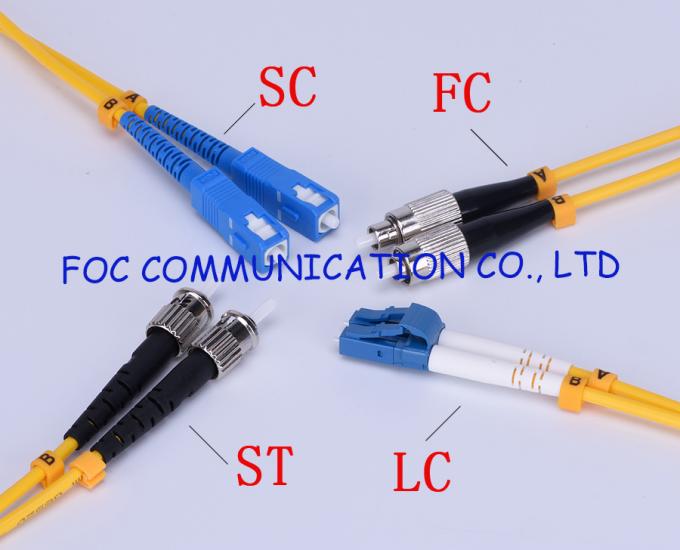
Where is `wires`? This screenshot has width=680, height=550. wires is located at coordinates click(x=35, y=508), click(x=18, y=490), click(x=82, y=77), click(x=96, y=90), click(x=624, y=186), click(x=617, y=159), click(x=641, y=392), click(x=634, y=401).